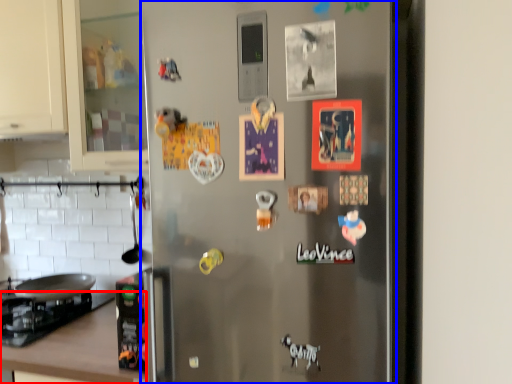
Question: Which object is closer to the camera taking this photo, counter top (highlighted by a red box) or refrigerator (highlighted by a blue box)?

Choices:
 (A) counter top
 (B) refrigerator

Answer: (B)